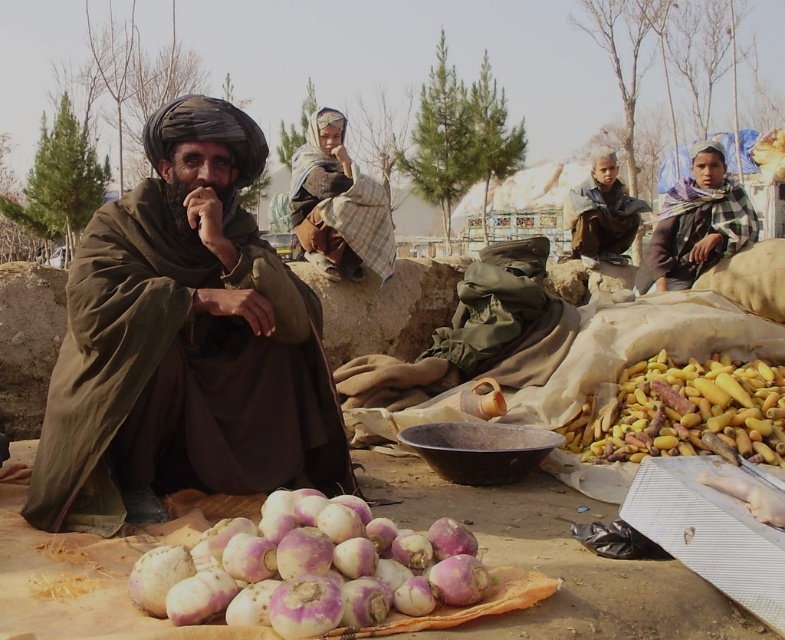
Is point (165, 595) positioned in front of point (696, 182)?

Yes, it is.

Measure the distance between purple-white turnip at lower center and camera.

purple-white turnip at lower center and camera are 1.83 meters apart.

Image resolution: width=785 pixels, height=640 pixels. Identify the location of purple-white turnip at lower center. (305, 557).

How distant is yellow matte root vegetables at lower right from plaid scarf at right?

yellow matte root vegetables at lower right and plaid scarf at right are 6.30 feet apart.

Between point (628, 416) and point (707, 204), which one is positioned behind?

The point (707, 204) is more distant.

Between point (623, 396) and point (672, 218), which one is positioned in front?

Point (623, 396) is more forward.

Where is `yellow matte root vegetables at lower right`? The height and width of the screenshot is (640, 785). yellow matte root vegetables at lower right is located at coordinates (683, 412).

Which is below, brown woolen robe at center or purple-white turnip at lower center?

purple-white turnip at lower center is lower down.

Is brown woolen robe at center thinner than purple-white turnip at lower center?

Incorrect, brown woolen robe at center's width is not less than purple-white turnip at lower center's.

Between point (139, 355) and point (272, 560), which one is positioned behind?

Point (139, 355)

The height and width of the screenshot is (640, 785). Identify the location of brown woolen robe at center. (184, 342).